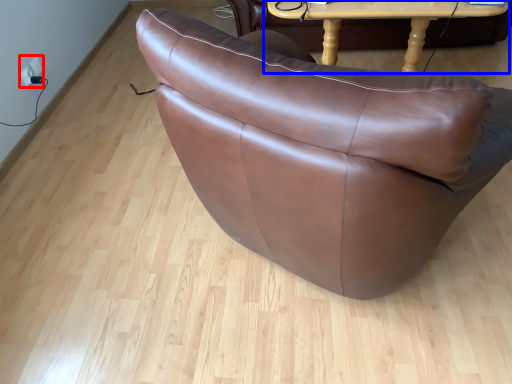
Question: Among these objects, which one is farthest to the camera, electric outlet (highlighted by a red box) or table (highlighted by a blue box)?

Choices:
 (A) electric outlet
 (B) table

Answer: (A)